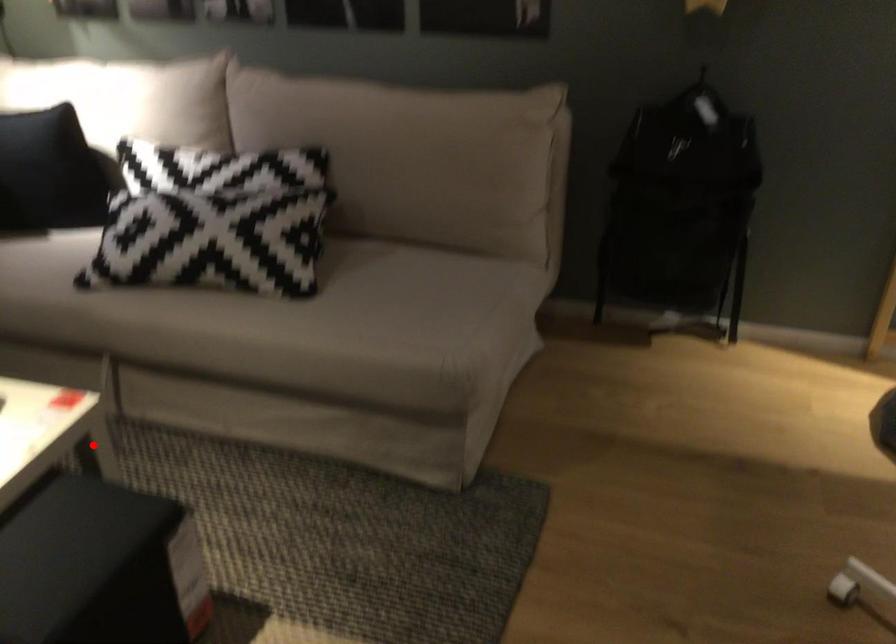
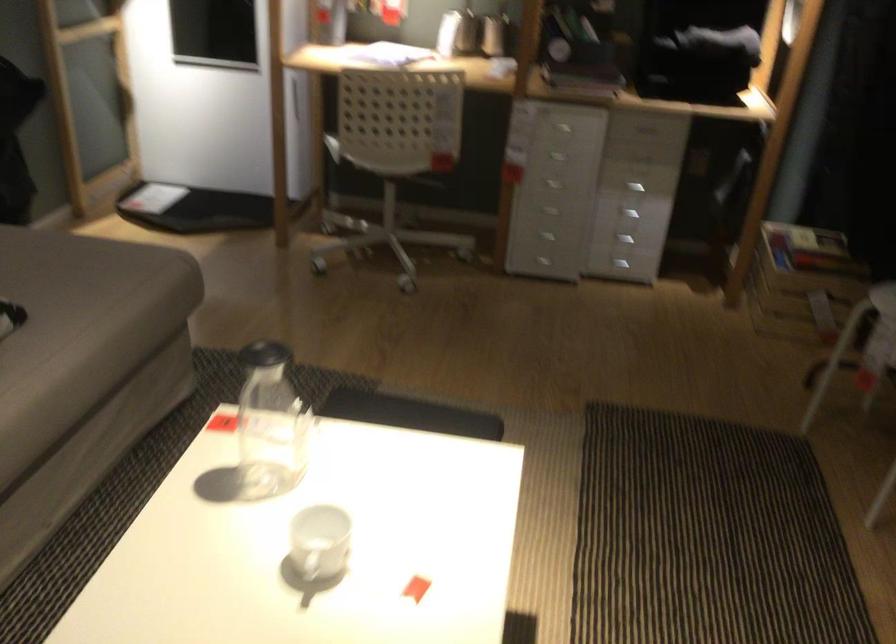
Question: I am providing you with two images of the same scene from different viewpoints. Image1 has a red point marked. In image2, the corresponding 3D location appears at what relative position? Reply with the corresponding letter.

Choices:
 (A) Closer
 (B) Farther

Answer: (A)